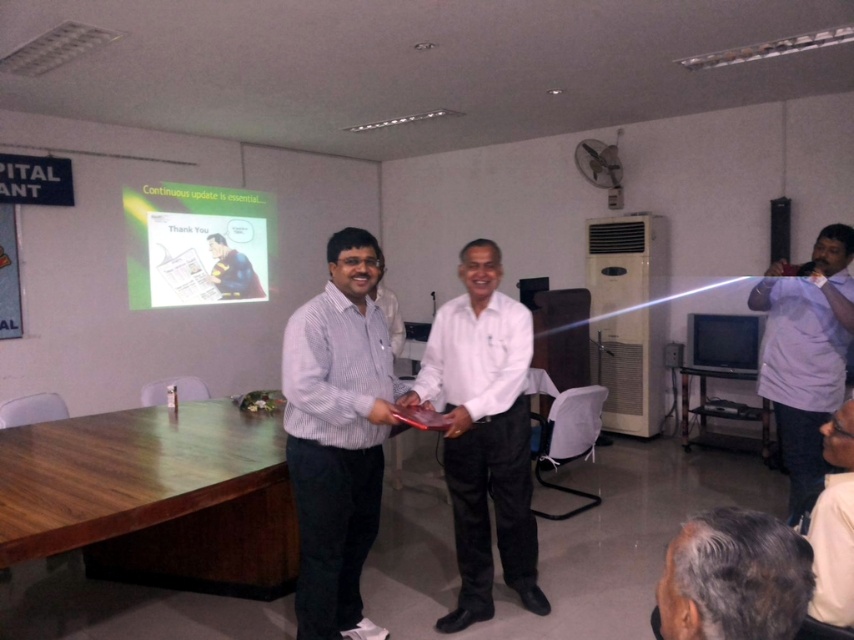
Question: Which point is closer to the camera?

Choices:
 (A) white glossy shirt at center
 (B) light blue shirt at right
 (C) metallic silver table at center
 (D) striped cotton shirt at center

Answer: (D)

Question: Among these objects, which one is nearest to the camera?

Choices:
 (A) gray hair at lower right
 (B) white glossy shirt at center

Answer: (A)

Question: Is gray hair at lower right to the left of metallic silver table at center from the viewer's perspective?

Choices:
 (A) no
 (B) yes

Answer: (B)

Question: Does white glossy shirt at center come behind metallic silver table at center?

Choices:
 (A) yes
 (B) no

Answer: (B)

Question: Which object is the closest to the white glossy shirt at center?

Choices:
 (A) striped cotton shirt at center
 (B) white shirt at center

Answer: (A)

Question: Can you confirm if white glossy shirt at center is positioned to the left of metallic silver table at center?

Choices:
 (A) no
 (B) yes

Answer: (B)